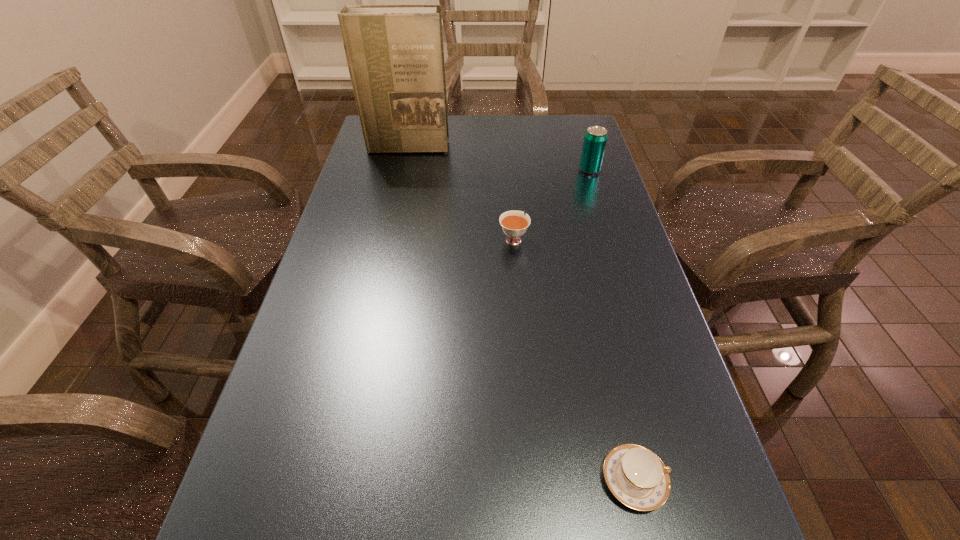
Find the location of a particular element. Image resolution: width=960 pixels, height=540 pixels. free space at the right edge of the desktop is located at coordinates (658, 511).

The height and width of the screenshot is (540, 960). In the image, there is a desktop. What are the coordinates of `free space at the far right corner` in the screenshot? It's located at (568, 135).

The image size is (960, 540). Find the location of `free spot between the taller teacup and the shortest object`. free spot between the taller teacup and the shortest object is located at coordinates [x=574, y=360].

This screenshot has height=540, width=960. I want to click on free space between the shorter teacup and the third object from right to left, so click(x=574, y=360).

Identify the location of empty space that is in between the tallest object and the beer can. (498, 158).

Locate an element on the screen. This screenshot has height=540, width=960. empty location between the phonebook and the third shortest object is located at coordinates click(498, 158).

Locate an element on the screen. This screenshot has height=540, width=960. unoccupied position between the leftmost object and the second shortest object is located at coordinates (460, 193).

The width and height of the screenshot is (960, 540). What are the coordinates of `vacant space in between the phonebook and the third nearest object` in the screenshot? It's located at (498, 158).

Where is `free space between the right teacup and the leftmost object`? The image size is (960, 540). free space between the right teacup and the leftmost object is located at coordinates (520, 314).

Find the location of `free spot between the tallest object and the third object from left to right`. free spot between the tallest object and the third object from left to right is located at coordinates (520, 314).